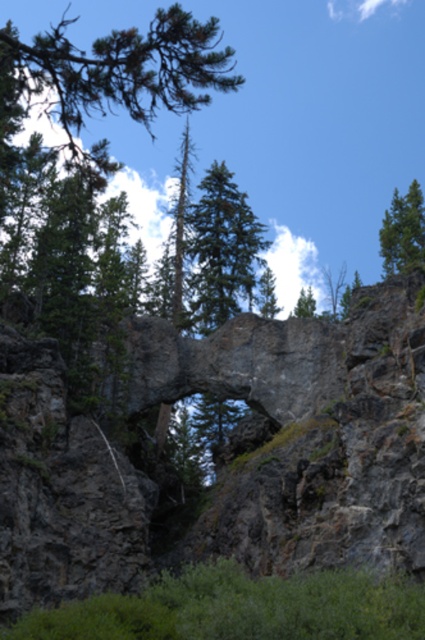
Question: Which point appears closest to the camera in this image?

Choices:
 (A) (198, 300)
 (B) (309, 305)

Answer: (A)

Question: In this image, where is green textured tree at center located relative to green leafy tree at upper center?

Choices:
 (A) left
 (B) right

Answer: (A)

Question: Does green textured tree at center lie behind green matte tree at upper right?

Choices:
 (A) yes
 (B) no

Answer: (A)

Question: Which is nearer to the green matte tree at upper right?

Choices:
 (A) green textured tree at center
 (B) green leafy tree at upper center

Answer: (A)

Question: Observing the image, what is the correct spatial positioning of green matte tree at upper right in reference to green leafy tree at upper center?

Choices:
 (A) below
 (B) above

Answer: (B)

Question: Which point appears farthest from the camera in this image?

Choices:
 (A) (401, 269)
 (B) (311, 298)
 (C) (232, 312)

Answer: (B)